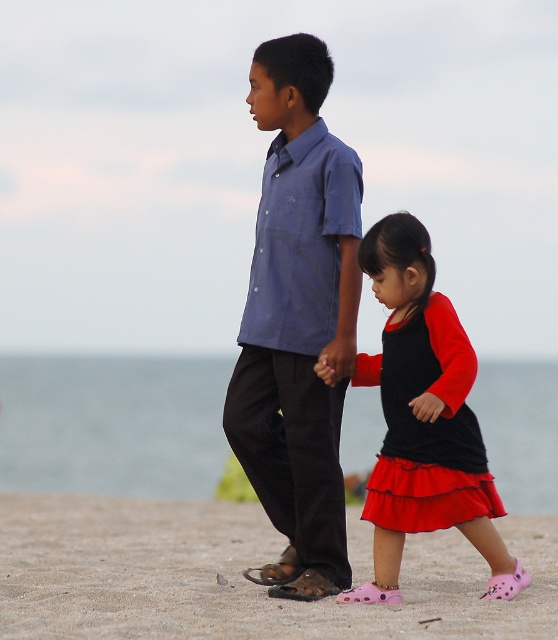
Question: Does brown leather sandal at lower center have a greater width compared to pink rubber sandal at lower center?

Choices:
 (A) no
 (B) yes

Answer: (A)

Question: Is matte black dress at lower center in front of brown leather sandal at lower center?

Choices:
 (A) yes
 (B) no

Answer: (A)

Question: Is matte black dress at lower center closer to camera compared to brown leather sandal at lower center?

Choices:
 (A) yes
 (B) no

Answer: (A)

Question: Which of these objects is positioned farthest from the brown leather sandal at lower center?

Choices:
 (A) black matte dress at lower right
 (B) sandy beach at lower center
 (C) matte black dress at lower center

Answer: (B)

Question: Estimate the real-world distances between objects in this image. Which object is closer to the pink rubber sandal at lower center?

Choices:
 (A) sandy beach at lower center
 (B) pink croc sandal at lower right
 (C) matte blue shirt at center

Answer: (B)

Question: Which object is positioned farthest from the matte blue shirt at center?

Choices:
 (A) pink rubber sandal at lower center
 (B) brown leather sandal at lower center
 (C) matte black dress at lower center
 (D) sandy beach at lower center

Answer: (D)